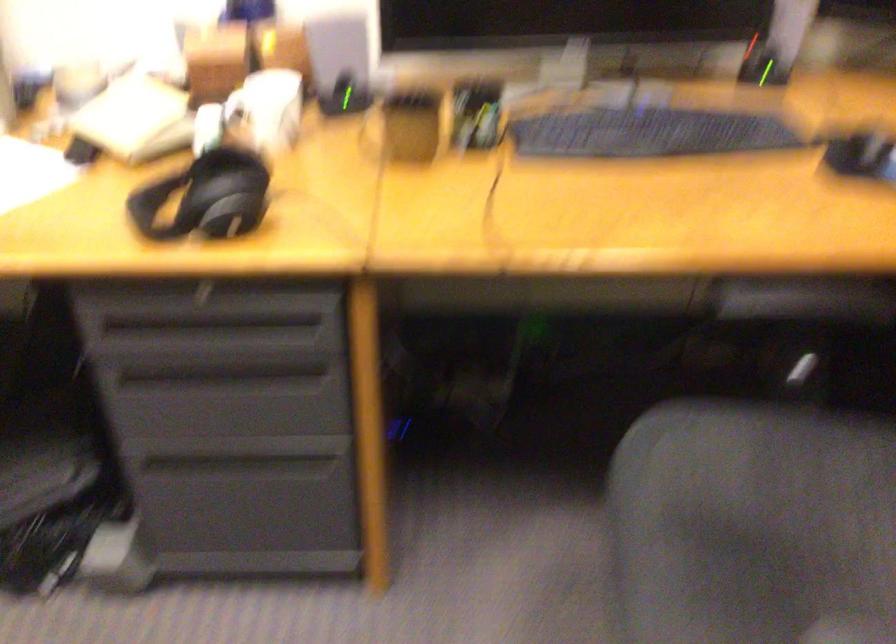
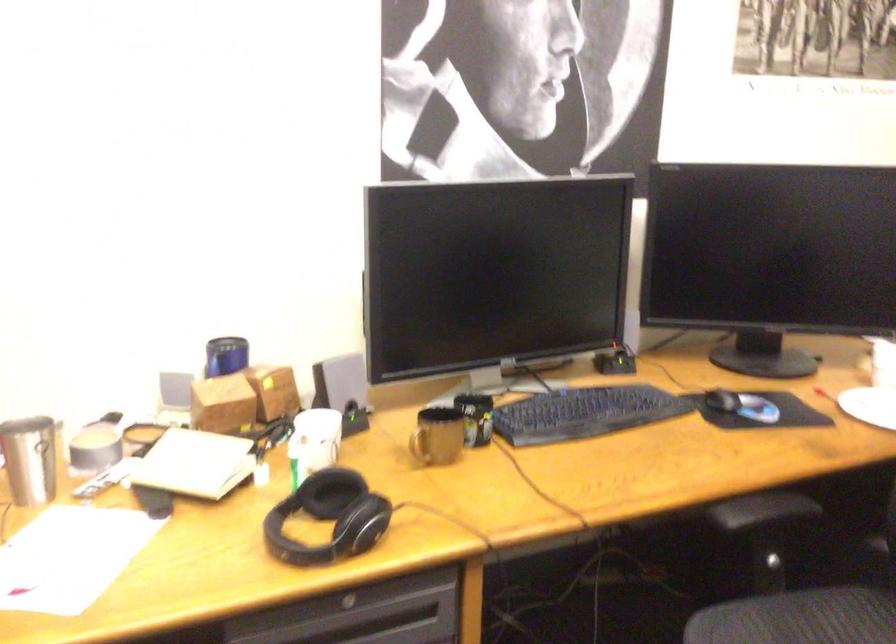
The point at (375, 134) is marked in the first image. Where is the corresponding point in the second image?

(419, 442)